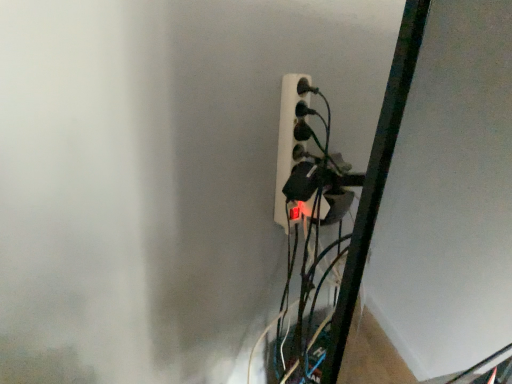
Identify the location of white plastic power plugs and sockets at center. (286, 140).

What do you see at coordinates (286, 140) in the screenshot? Image resolution: width=512 pixels, height=384 pixels. I see `white plastic power plugs and sockets at center` at bounding box center [286, 140].

What is the approximate height of white plastic power plugs and sockets at center?

The height of white plastic power plugs and sockets at center is 12.28 inches.

Find the location of a particular element. The width and height of the screenshot is (512, 384). white plastic power plugs and sockets at center is located at coordinates (286, 140).